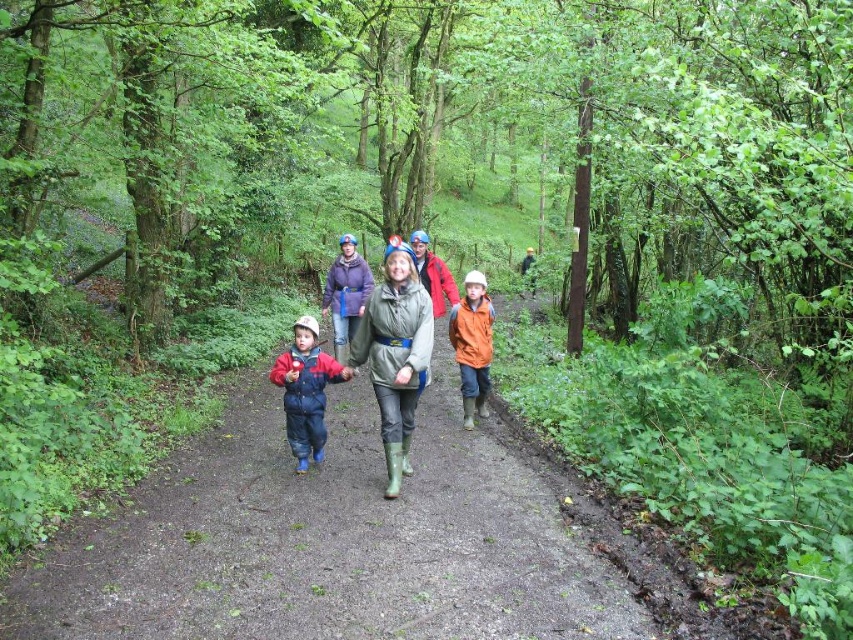
Is green rubber boots at center below orange matte jacket at center?

Incorrect, green rubber boots at center is not positioned below orange matte jacket at center.

Which is below, green rubber boots at center or orange matte jacket at center?

orange matte jacket at center is lower down.

Where is `green rubber boots at center`? The width and height of the screenshot is (853, 640). green rubber boots at center is located at coordinates (395, 353).

In order to click on green rubber boots at center in this screenshot , I will do `click(395, 353)`.

Which is below, matte orange jacket at center or orange matte jacket at center?

Positioned lower is orange matte jacket at center.

Is matte orange jacket at center wider than orange matte jacket at center?

Yes.

Is point (390, 272) positioned behind point (485, 292)?

That is False.

Find the location of `matte orange jacket at center`. matte orange jacket at center is located at coordinates (395, 353).

Who is positioned more to the right, green rubber boots at center or matte blue jumpsuit at center?

Positioned to the right is green rubber boots at center.

Is green rubber boots at center positioned in front of matte blue jumpsuit at center?

Yes, green rubber boots at center is closer to the viewer.

Measure the distance between green rubber boots at center and camera.

A distance of 6.77 meters exists between green rubber boots at center and camera.

The image size is (853, 640). Identify the location of green rubber boots at center. (395, 353).